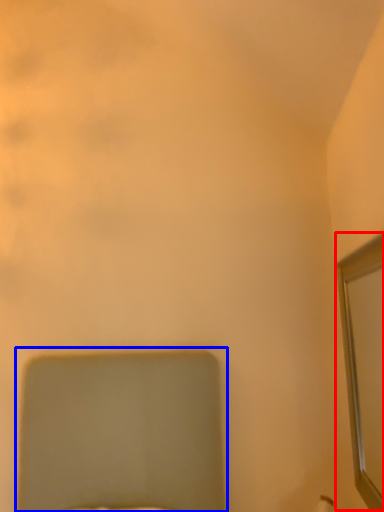
Question: Among these objects, which one is nearest to the camera, mirror (highlighted by a red box) or bed (highlighted by a blue box)?

Choices:
 (A) mirror
 (B) bed

Answer: (B)